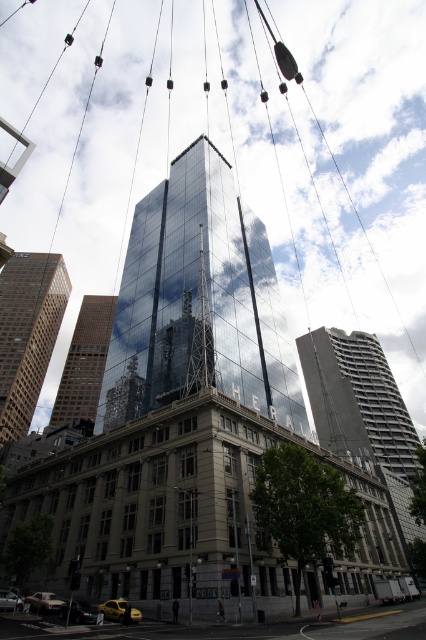
Question: Is reflective glass tower at center in front of glassy reflective skyscraper at center?

Choices:
 (A) yes
 (B) no

Answer: (A)

Question: Which of the following is the farthest from the observer?

Choices:
 (A) (60, 388)
 (B) (29, 336)
 (C) (233, 372)

Answer: (A)

Question: Does reflective glass tower at center have a larger size compared to brown glass skyscraper at left?

Choices:
 (A) yes
 (B) no

Answer: (B)

Question: Observing the image, what is the correct spatial positioning of brown glass skyscraper at left in reference to glassy reflective skyscraper at center?

Choices:
 (A) left
 (B) right

Answer: (A)

Question: Which point is closer to the camera taking this photo?

Choices:
 (A) (69, 380)
 (B) (17, 342)

Answer: (B)

Question: Which point is closer to the camera?

Choices:
 (A) (224, 173)
 (B) (9, 317)
 (C) (368, 413)
 (D) (83, 390)

Answer: (A)